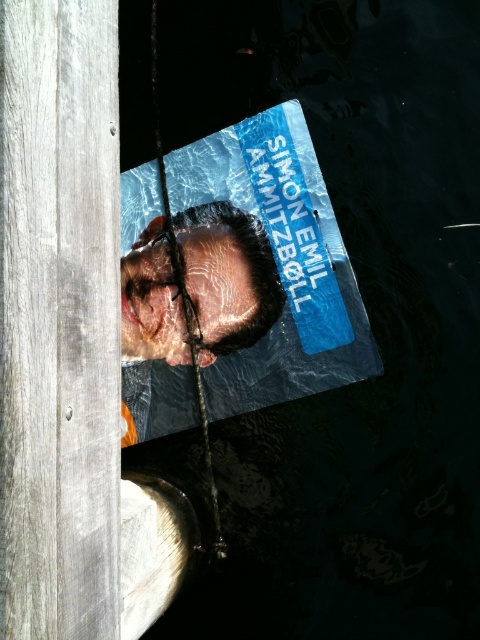
Is matte plastic poster at center positioned in front of shiny metallic head at center?

Yes.

Can you confirm if matte plastic poster at center is wider than shiny metallic head at center?

Correct, the width of matte plastic poster at center exceeds that of shiny metallic head at center.

At what (x,y) coordinates should I click in order to perform the action: click on matte plastic poster at center. Please return your answer as a coordinate pair (x, y). Looking at the image, I should click on (265, 266).